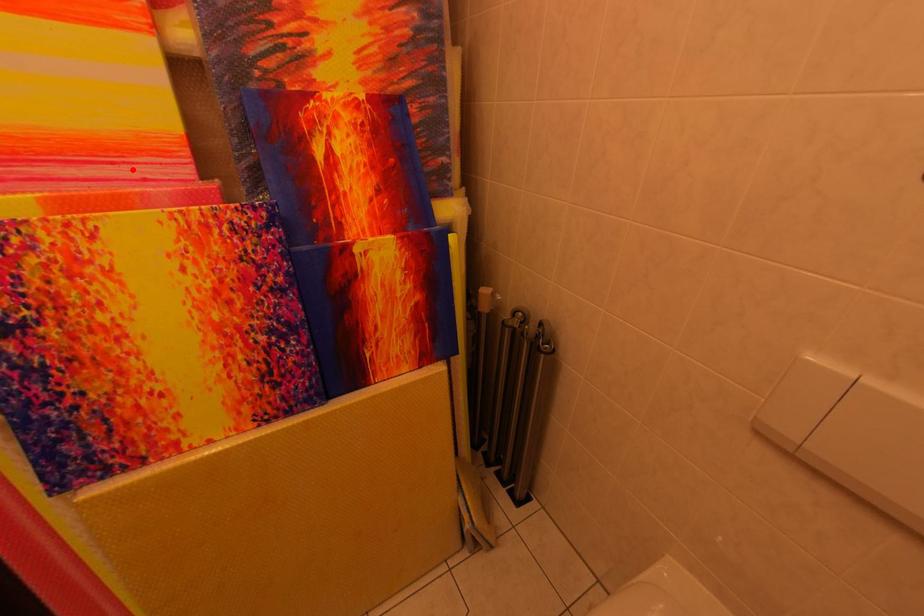
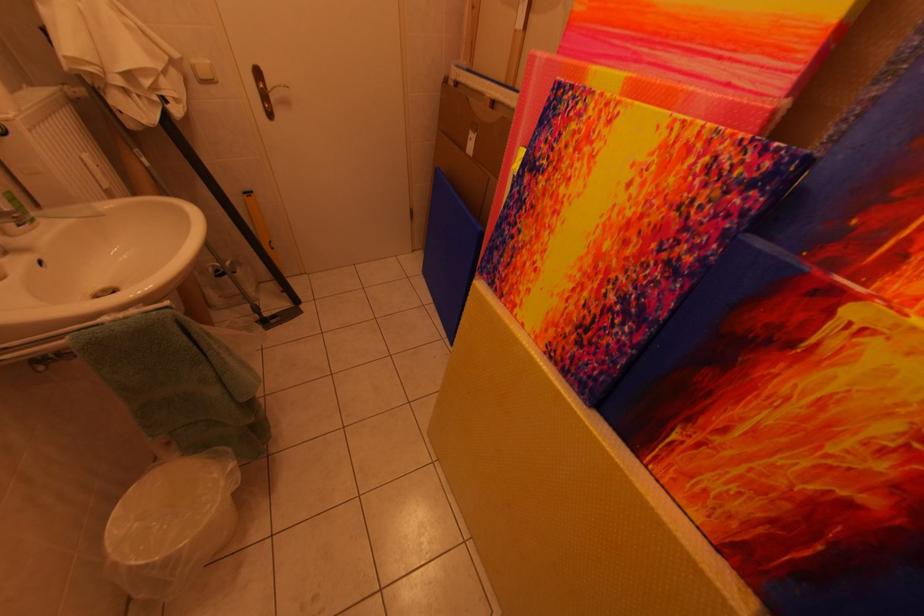
Locate, in the second image, the point that corresponds to the highlighted location in the first image.

(734, 68)